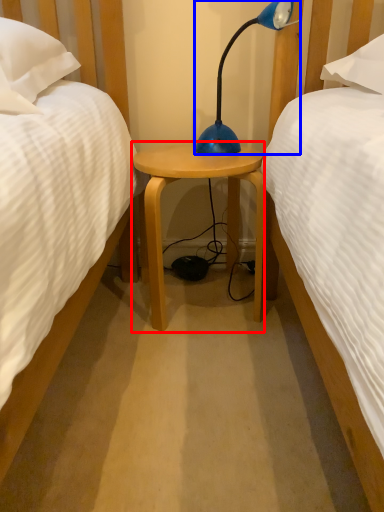
Question: Which of the following is the farthest to the observer, nightstand (highlighted by a red box) or lamp (highlighted by a blue box)?

Choices:
 (A) nightstand
 (B) lamp

Answer: (A)